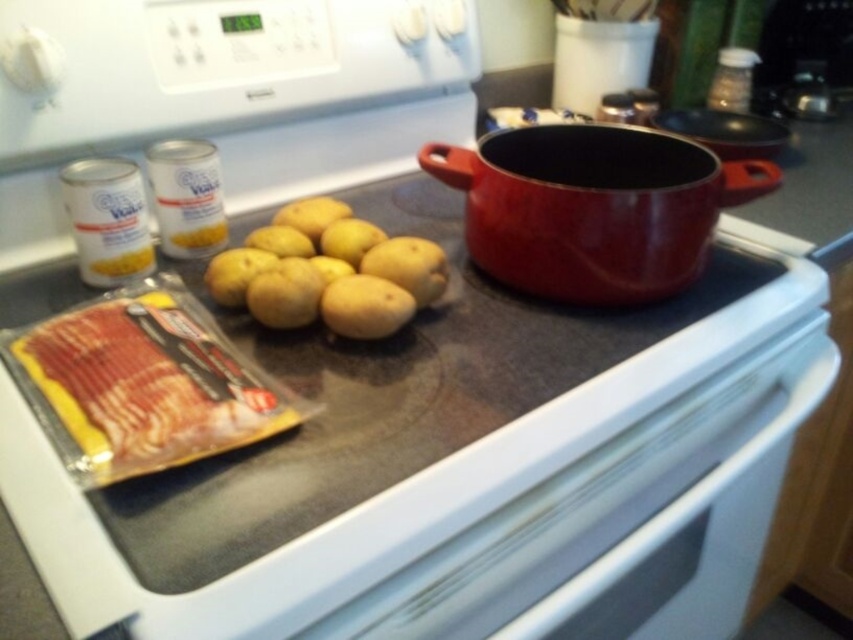
You are standing in the kitchen and want to reach both the white glossy oven at lower center and the matte red pot at center. Which object will you need to move closer to first?

The white glossy oven at lower center is closer to the viewer than the matte red pot at center, so you will need to move closer to the white glossy oven at lower center first.

You are standing in the kitchen and want to cook on the white glossy gas stove at center. Where should you go to find it?

The white glossy gas stove at center is located at the center of the kitchen at coordinates point (387, 396).